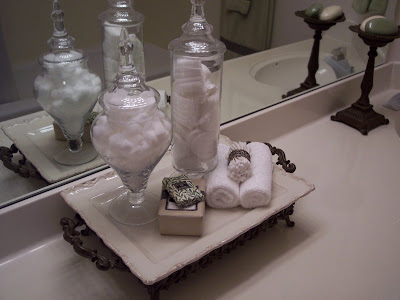
The height and width of the screenshot is (300, 400). What are the coordinates of `glass lid` in the screenshot? It's located at [124, 56], [195, 16].